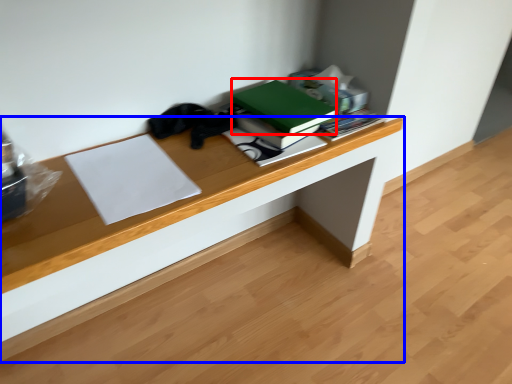
Question: Which object is further to the camera taking this photo, paperback book (highlighted by a red box) or desk (highlighted by a blue box)?

Choices:
 (A) paperback book
 (B) desk

Answer: (B)